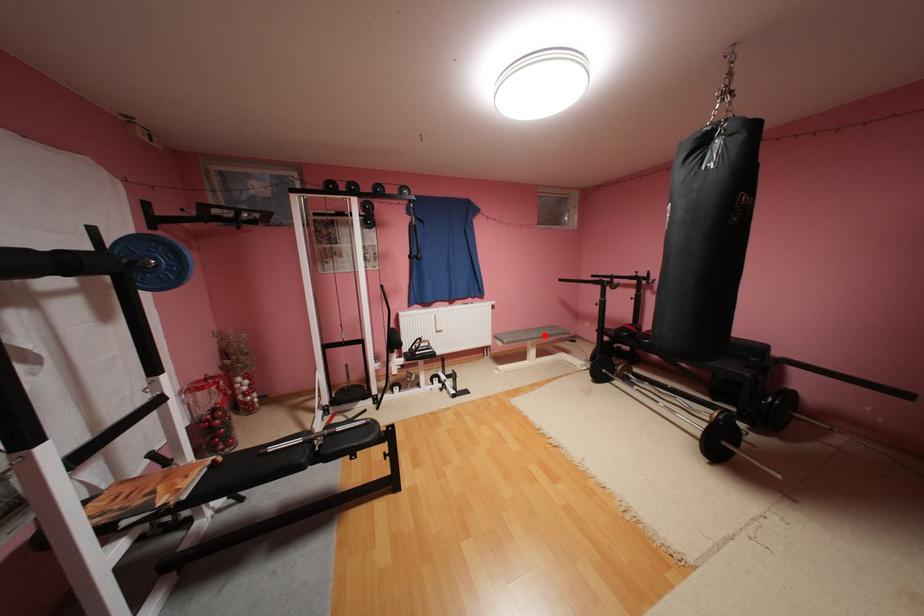
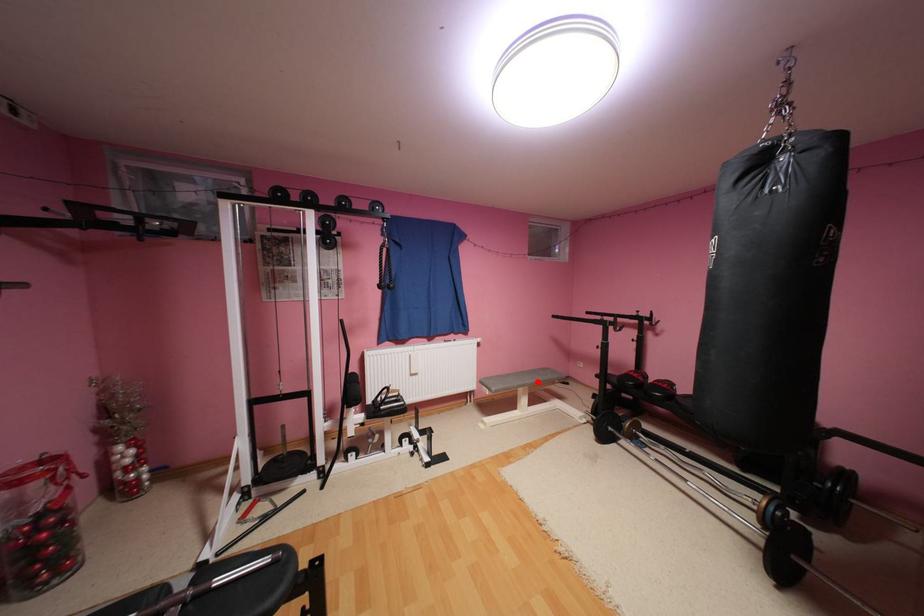
I am providing you with two images of the same scene from different viewpoints. A red point is marked on the first image and another point is marked on the second image. Do the highlighted points in image1 and image2 indicate the same real-world spot?

Yes